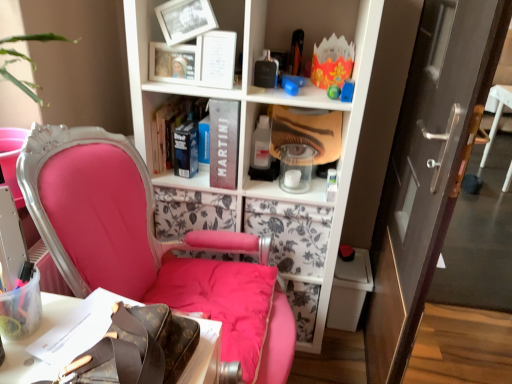
Question: From their relative heights in the image, would you say matte pink chair at left is taller or shorter than brown leather bag at lower left?

Choices:
 (A) short
 (B) tall

Answer: (B)

Question: Considering the positions of point (226, 244) and point (38, 367), is point (226, 244) closer or farther from the camera than point (38, 367)?

Choices:
 (A) closer
 (B) farther

Answer: (B)

Question: Based on their relative distances, which object is nearer to the matte pink chair at left?

Choices:
 (A) hardcover book at center, which ranks as the first book in left-to-right order
 (B) brown leather bag at lower left
 (C) matte black book at center, which is counted as the second book, starting from the left
 (D) matte brown door at right
 (E) matte plastic mask at upper center

Answer: (B)

Question: Which object is positioned farthest from the matte brown door at right?

Choices:
 (A) hardcover book at center, which is counted as the second book, starting from the right
 (B) matte black book at center, the 1th book in the right-to-left sequence
 (C) brown leather bag at lower left
 (D) matte plastic mask at upper center
 (E) matte pink chair at left

Answer: (C)